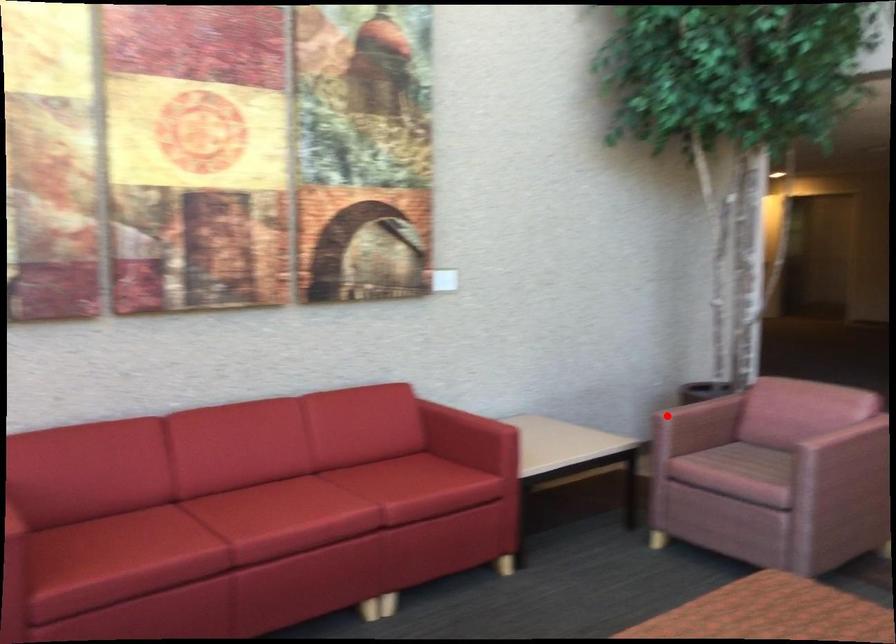
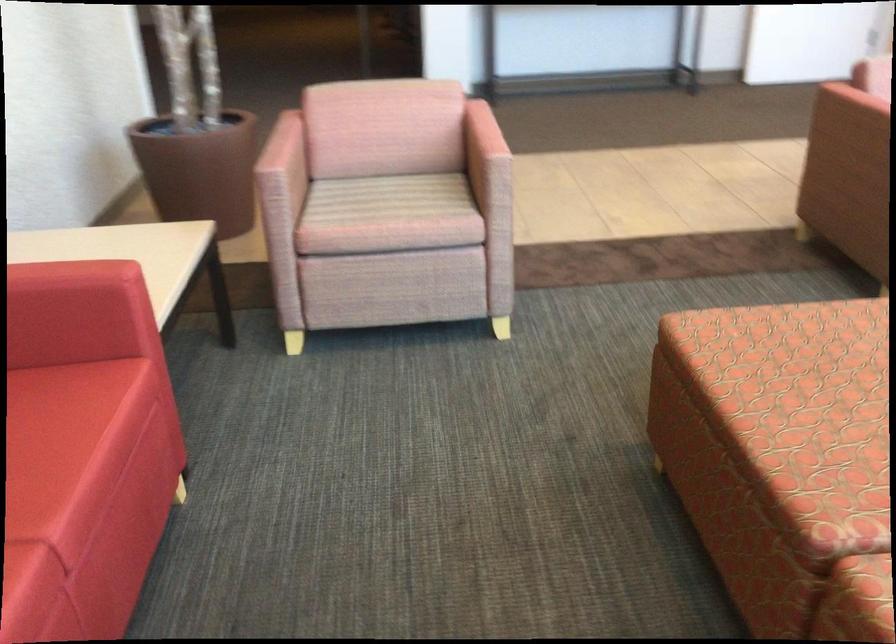
Find the pixel in the second image that matches the highlighted location in the first image.

(280, 176)